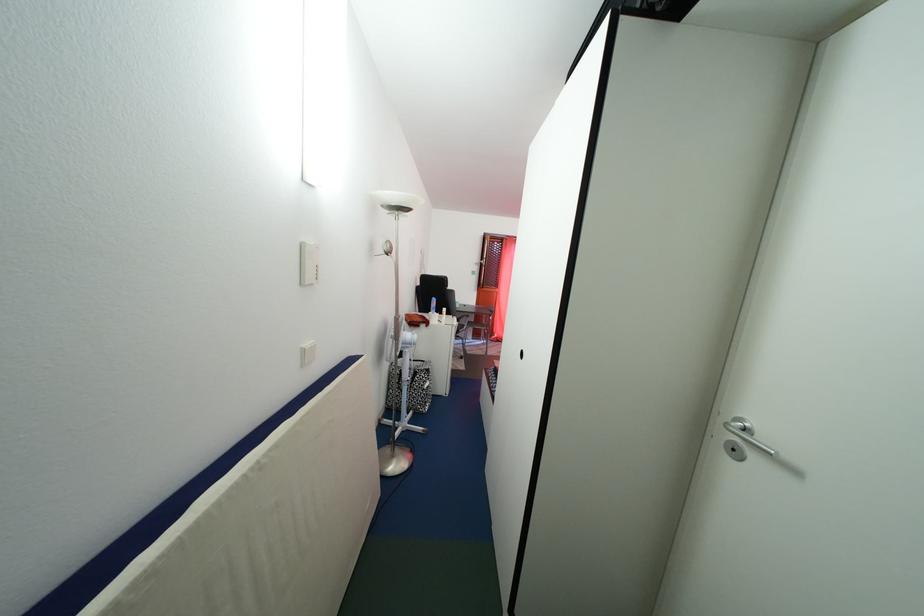
The width and height of the screenshot is (924, 616). What do you see at coordinates (384, 249) in the screenshot?
I see `a floor lamp switch` at bounding box center [384, 249].